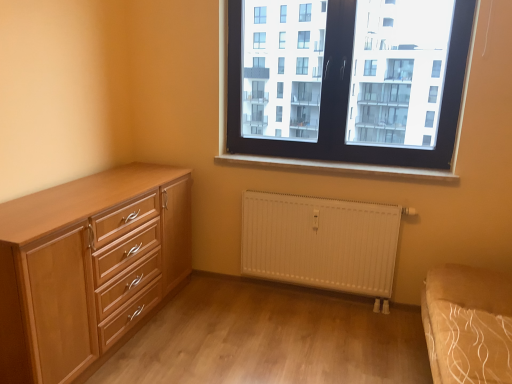
Where is `vacant space in front of white matte radiator at lower center`? The width and height of the screenshot is (512, 384). vacant space in front of white matte radiator at lower center is located at coordinates (310, 339).